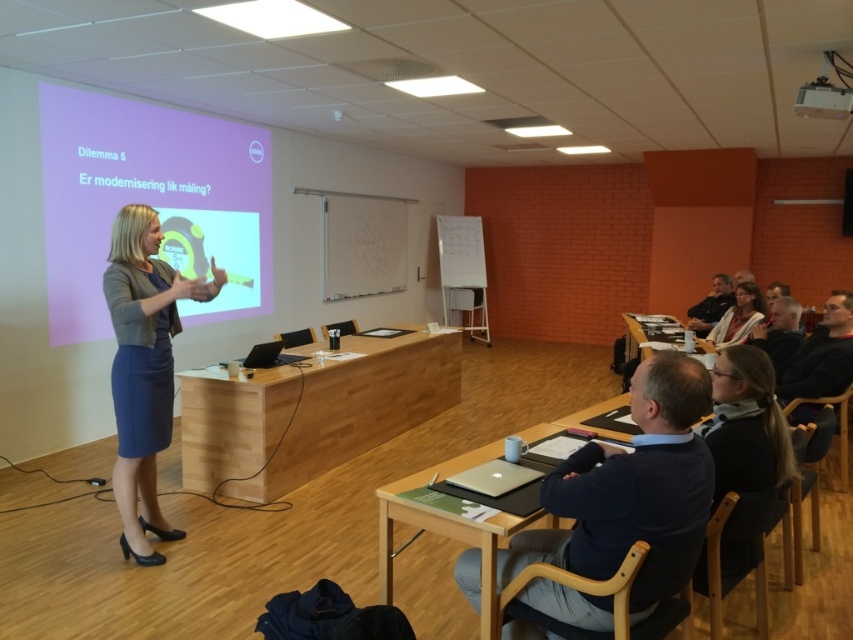
Can you confirm if blue fabric skirt at center is positioned to the right of dark brown leather jacket at upper right?

Incorrect, blue fabric skirt at center is not on the right side of dark brown leather jacket at upper right.

Can you confirm if blue fabric skirt at center is positioned below dark brown leather jacket at upper right?

Yes.

Does point (131, 492) come behind point (724, 307)?

No, it is in front of (724, 307).

This screenshot has height=640, width=853. In order to click on blue fabric skirt at center in this screenshot , I will do `click(144, 368)`.

Which is in front, point (709, 305) or point (845, 195)?

Point (709, 305) is more forward.

Does dark brown leather jacket at upper right have a lesser width compared to black matte speaker at center?

Incorrect, dark brown leather jacket at upper right's width is not less than black matte speaker at center's.

What do you see at coordinates (711, 305) in the screenshot? The image size is (853, 640). I see `dark brown leather jacket at upper right` at bounding box center [711, 305].

The width and height of the screenshot is (853, 640). Identify the location of dark brown leather jacket at upper right. (711, 305).

Does matte white projector screen at upper left appear over matte beige sweater at upper right?

Correct, matte white projector screen at upper left is located above matte beige sweater at upper right.

Is matte white projector screen at upper left positioned at the back of matte beige sweater at upper right?

No, it is not.

Who is more distant from viewer, (x=90, y=113) or (x=752, y=301)?

The point (x=752, y=301) is more distant.

In order to click on matte white projector screen at upper left in this screenshot , I will do (149, 202).